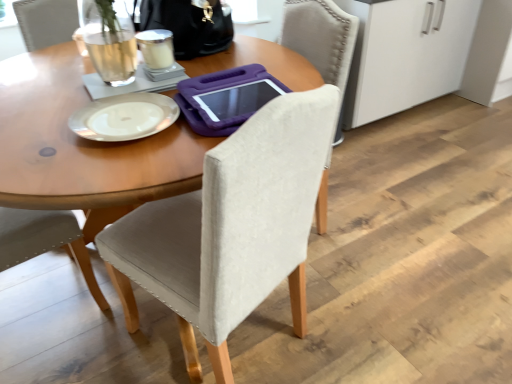
Question: From a real-world perspective, is black leather handbag at upper center on white glossy plate at upper center?

Choices:
 (A) yes
 (B) no

Answer: (A)

Question: Would you say black leather handbag at upper center contains white glossy plate at upper center?

Choices:
 (A) yes
 (B) no

Answer: (B)

Question: Is black leather handbag at upper center to the left of white glossy plate at upper center from the viewer's perspective?

Choices:
 (A) no
 (B) yes

Answer: (A)

Question: Is black leather handbag at upper center closer to camera compared to white glossy plate at upper center?

Choices:
 (A) yes
 (B) no

Answer: (B)

Question: Is black leather handbag at upper center completely or partially outside of white glossy plate at upper center?

Choices:
 (A) no
 (B) yes

Answer: (B)

Question: Is beige fabric chair at center taller or shorter than white glossy plate at upper center?

Choices:
 (A) short
 (B) tall

Answer: (B)

Question: Considering the relative positions of beige fabric chair at center and white glossy plate at upper center in the image provided, is beige fabric chair at center to the left or to the right of white glossy plate at upper center?

Choices:
 (A) left
 (B) right

Answer: (B)

Question: From a real-world perspective, is beige fabric chair at center physically located above or below white glossy plate at upper center?

Choices:
 (A) above
 (B) below

Answer: (B)

Question: Would you say beige fabric chair at center is inside or outside white glossy plate at upper center?

Choices:
 (A) outside
 (B) inside

Answer: (A)

Question: From a real-world perspective, is white frosted glass at upper center positioned above or below white glossy plate at upper center?

Choices:
 (A) below
 (B) above

Answer: (B)

Question: Is white frosted glass at upper center wider or thinner than white glossy plate at upper center?

Choices:
 (A) thin
 (B) wide

Answer: (A)

Question: Is white frosted glass at upper center bigger or smaller than white glossy plate at upper center?

Choices:
 (A) small
 (B) big

Answer: (A)

Question: Do you think white frosted glass at upper center is within white glossy plate at upper center, or outside of it?

Choices:
 (A) inside
 (B) outside

Answer: (B)

Question: Is beige fabric chair at center in front of or behind black leather handbag at upper center in the image?

Choices:
 (A) behind
 (B) front

Answer: (B)

Question: Looking at the image, does beige fabric chair at center seem bigger or smaller compared to black leather handbag at upper center?

Choices:
 (A) big
 (B) small

Answer: (A)